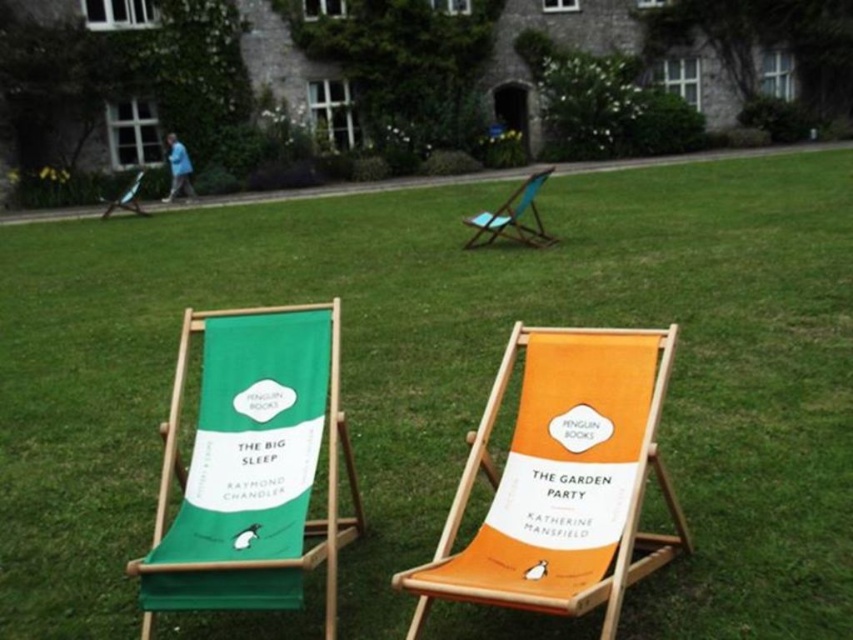
Does green fabric beach chair at left have a greater height compared to teal fabric chair at upper center?

Yes.

Which is in front, point (222, 353) or point (538, 230)?

Point (222, 353)

Image resolution: width=853 pixels, height=640 pixels. What are the coordinates of `green fabric beach chair at left` in the screenshot? It's located at (252, 467).

Which is behind, point (194, 458) or point (143, 172)?

The point (143, 172) is more distant.

Which is above, green fabric beach chair at left or matte green deck chair at center?

Positioned higher is matte green deck chair at center.

Where is `green fabric beach chair at left`? The image size is (853, 640). green fabric beach chair at left is located at coordinates (252, 467).

Between orange fabric beach chair at center and matte green deck chair at center, which one is positioned lower?

orange fabric beach chair at center is lower down.

Between orange fabric beach chair at center and matte green deck chair at center, which one has more height?

Standing taller between the two is orange fabric beach chair at center.

Does point (634, 576) come behind point (144, 212)?

No, (634, 576) is closer to viewer.

What are the coordinates of `orange fabric beach chair at center` in the screenshot? It's located at (561, 481).